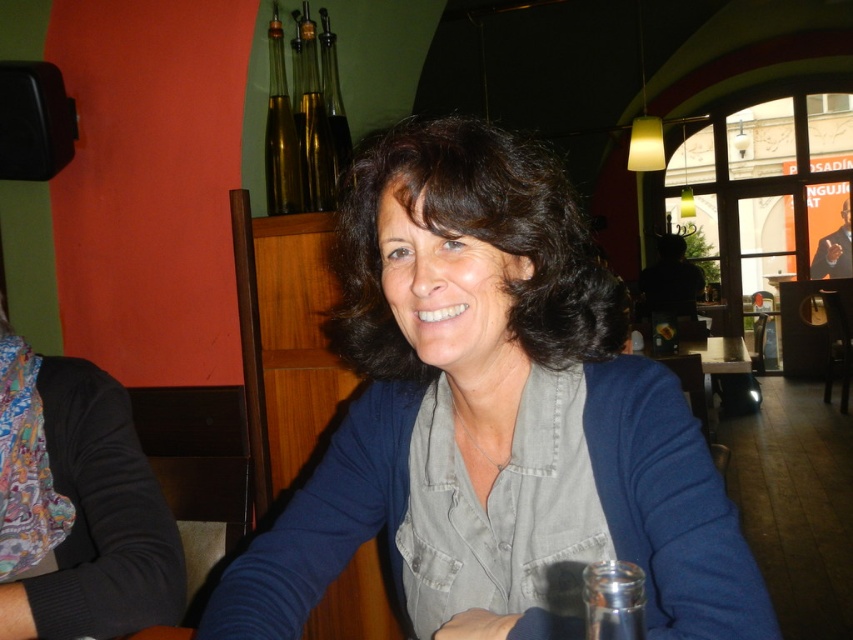
Which of these two, brown glass bottle at upper left or shiny glass bottle at upper center, stands taller?

brown glass bottle at upper left

Between point (271, 102) and point (334, 100), which one is positioned behind?

The point (334, 100) is behind.

At what (x,y) coordinates should I click in order to perform the action: click on brown glass bottle at upper left. Please return your answer as a coordinate pair (x, y). Looking at the image, I should click on (280, 132).

Identify the location of brown glass bottle at upper left. (280, 132).

Does brown glass bottle at upper left have a lesser height compared to white glossy table at center?

Incorrect, brown glass bottle at upper left's height does not fall short of white glossy table at center's.

Can you confirm if brown glass bottle at upper left is positioned below white glossy table at center?

Actually, brown glass bottle at upper left is above white glossy table at center.

Find the location of a particular element. brown glass bottle at upper left is located at coordinates (280, 132).

Can you confirm if gold glass bottles at upper center is positioned to the left of transparent glass at lower right?

Correct, you'll find gold glass bottles at upper center to the left of transparent glass at lower right.

Does gold glass bottles at upper center have a greater height compared to transparent glass at lower right?

Indeed, gold glass bottles at upper center has a greater height compared to transparent glass at lower right.

This screenshot has width=853, height=640. What do you see at coordinates (314, 125) in the screenshot? I see `gold glass bottles at upper center` at bounding box center [314, 125].

At what (x,y) coordinates should I click in order to perform the action: click on gold glass bottles at upper center. Please return your answer as a coordinate pair (x, y). The image size is (853, 640). Looking at the image, I should click on (314, 125).